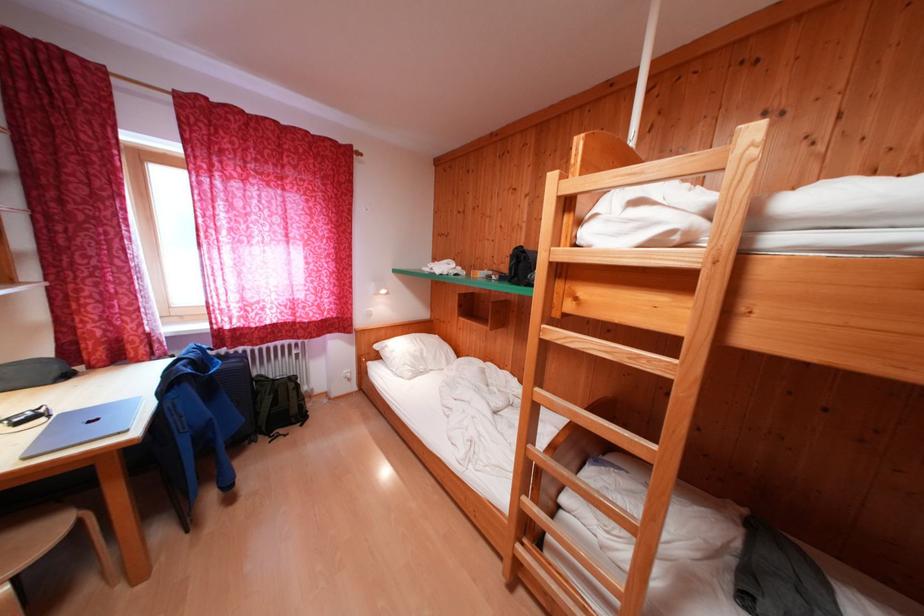
Locate an element on the screen. The height and width of the screenshot is (616, 924). chair sitting surface is located at coordinates (43, 546).